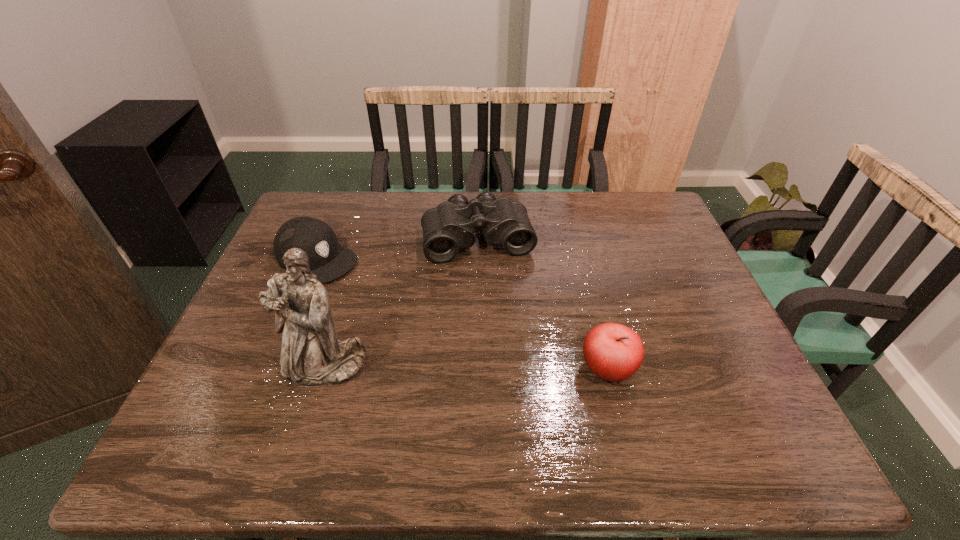
In the image, there is a desktop. Where is `vacant space at the near left corner`? This screenshot has height=540, width=960. vacant space at the near left corner is located at coordinates (227, 394).

You are a GUI agent. You are given a task and a screenshot of the screen. Output one action in this format:
    pyautogui.click(x=<x>, y=<y>)
    Task: Click on the free point at the far right corner
    
    Given the screenshot: What is the action you would take?
    pyautogui.click(x=638, y=218)

Identify the location of blank area at the near right corner. (764, 409).

Locate an element on the screen. empty space that is in between the cap and the binoculars is located at coordinates (397, 249).

Find the location of `free space between the tallest object and the second object from right to left`. free space between the tallest object and the second object from right to left is located at coordinates (401, 302).

Where is `unoccupied area between the tallest object and the rightmost object`? The height and width of the screenshot is (540, 960). unoccupied area between the tallest object and the rightmost object is located at coordinates (467, 368).

Locate an element on the screen. free space between the cap and the rightmost object is located at coordinates (462, 314).

Find the location of `free space between the cap and the apple`. free space between the cap and the apple is located at coordinates (462, 314).

At what (x,y) coordinates should I click in order to perform the action: click on vacant area that lies between the figurine and the rightmost object. Please return your answer as a coordinate pair (x, y). Image resolution: width=960 pixels, height=540 pixels. Looking at the image, I should click on (467, 368).

The height and width of the screenshot is (540, 960). I want to click on vacant point located between the cap and the binoculars, so click(x=397, y=249).